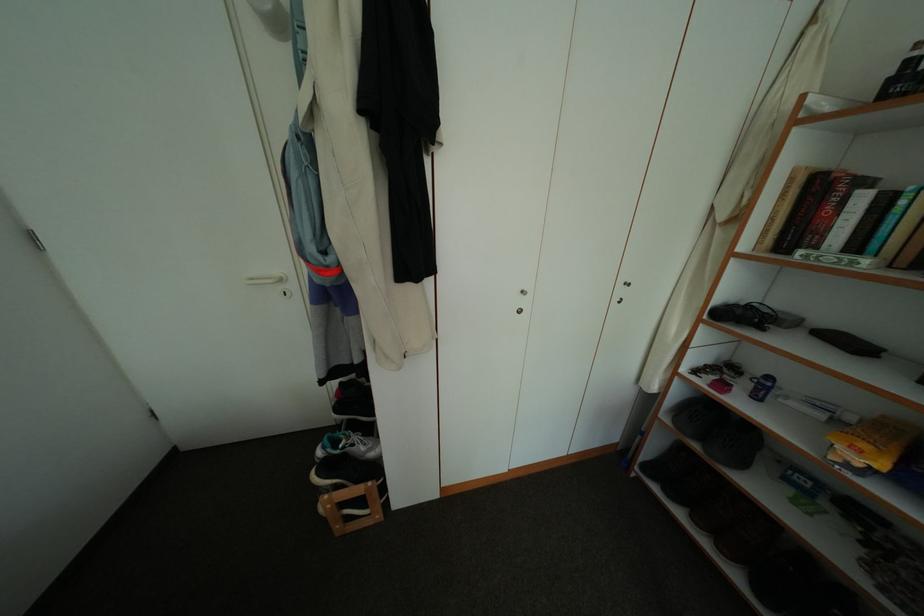
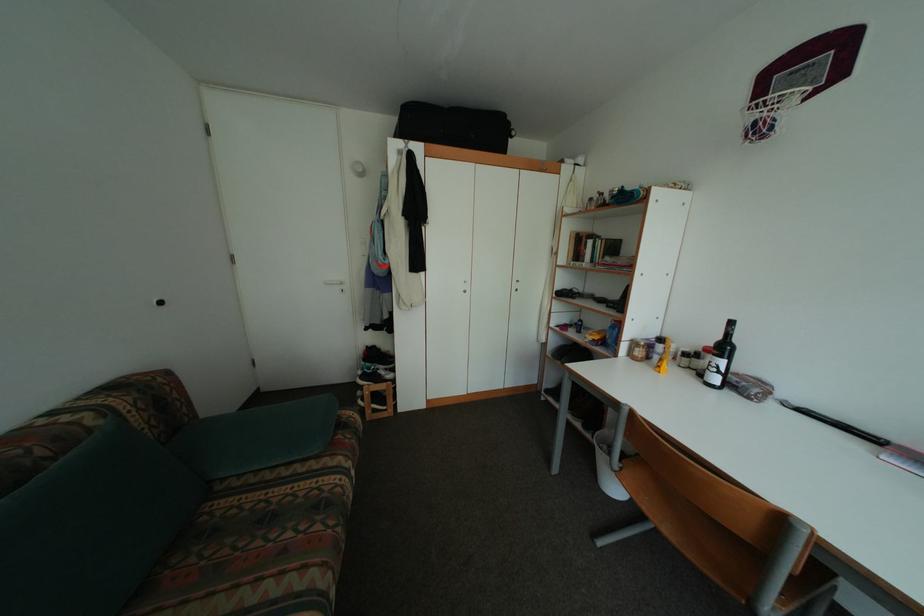
Question: What movement of the cameraman would produce the second image?

Choices:
 (A) Left
 (B) Right
 (C) Forward
 (D) Backward

Answer: (D)